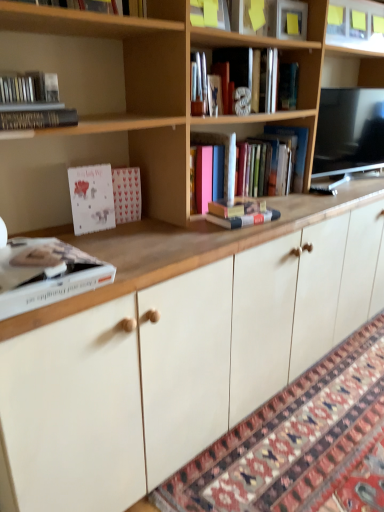
Locate an element on the screen. free location to the left of hardcover book at center, the 5th book positioned from the left is located at coordinates (192, 222).